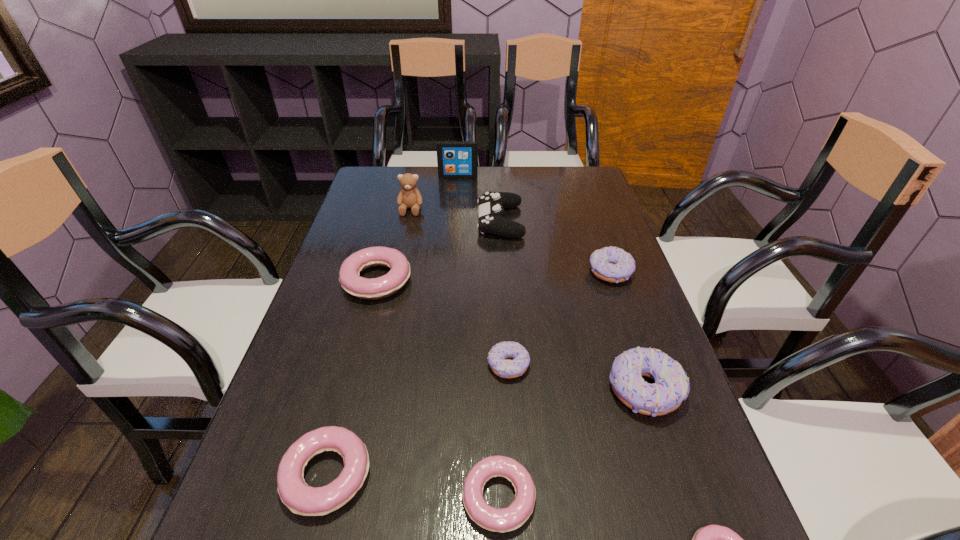
You are a GUI agent. You are given a task and a screenshot of the screen. Output one action in this format:
    pyautogui.click(x=<x>, y=<y>)
    Task: Click on the unoccupied area between the second smallest brown doughnut and the farthest object
    
    Given the screenshot: What is the action you would take?
    coord(534,224)

The image size is (960, 540). What are the coordinates of `free area in between the iPod and the biggest brown doughnut` in the screenshot? It's located at (551, 284).

Choose which object is the fifth nearest neighbor to the teddy bear. Please provide its 2D coordinates. Your answer should be formatted as a tuple, i.e. [(x, y)], where the tuple contains the x and y coordinates of a point satisfying the conditions above.

[(497, 356)]

Image resolution: width=960 pixels, height=540 pixels. I want to click on object that is the fourth closest to the biggest pink doughnut, so click(x=298, y=496).

In order to click on doughnut that is the fifth closest one to the biggest pink doughnut in this screenshot , I will do `click(671, 387)`.

Find the location of a particular element. The height and width of the screenshot is (540, 960). doughnut that stands as the fifth closest to the farthest object is located at coordinates (298, 496).

Identify which brown doughnut is the second nearest to the smallest brown doughnut. Please provide its 2D coordinates. Your answer should be formatted as a tuple, i.e. [(x, y)], where the tuple contains the x and y coordinates of a point satisfying the conditions above.

[(611, 264)]

Locate an element on the screen. This screenshot has height=540, width=960. the third closest brown doughnut relative to the third biggest pink doughnut is located at coordinates (611, 264).

Where is `pink doughnut that is the third closest to the smallest pink doughnut`? pink doughnut that is the third closest to the smallest pink doughnut is located at coordinates (382, 287).

I want to click on pink doughnut identified as the second closest to the smallest pink doughnut, so click(298, 496).